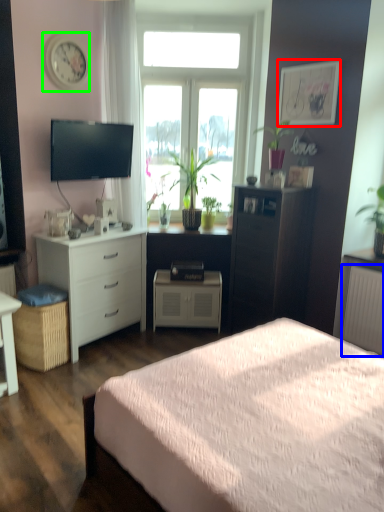
Question: Based on their relative distances, which object is nearer to picture frame (highlighted by a red box)? Choose from radiator (highlighted by a blue box) and clock (highlighted by a green box).

Choices:
 (A) radiator
 (B) clock

Answer: (A)